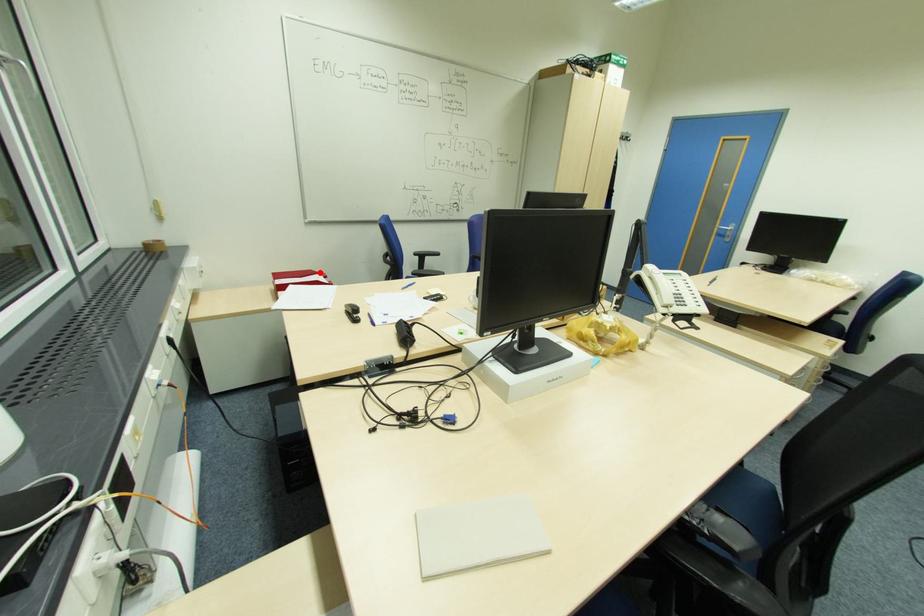
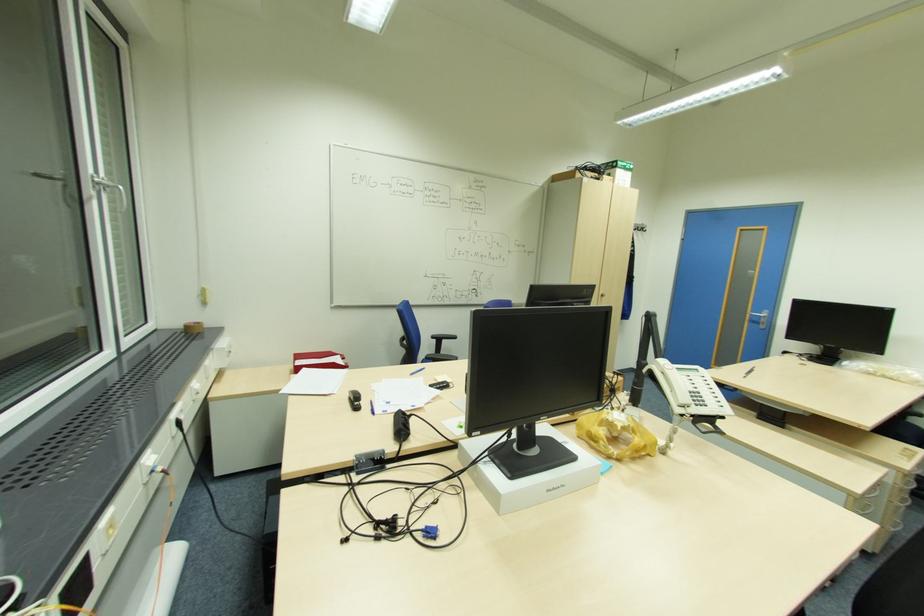
In the second image, find the point that corresponds to the highlighted location in the first image.

(338, 354)